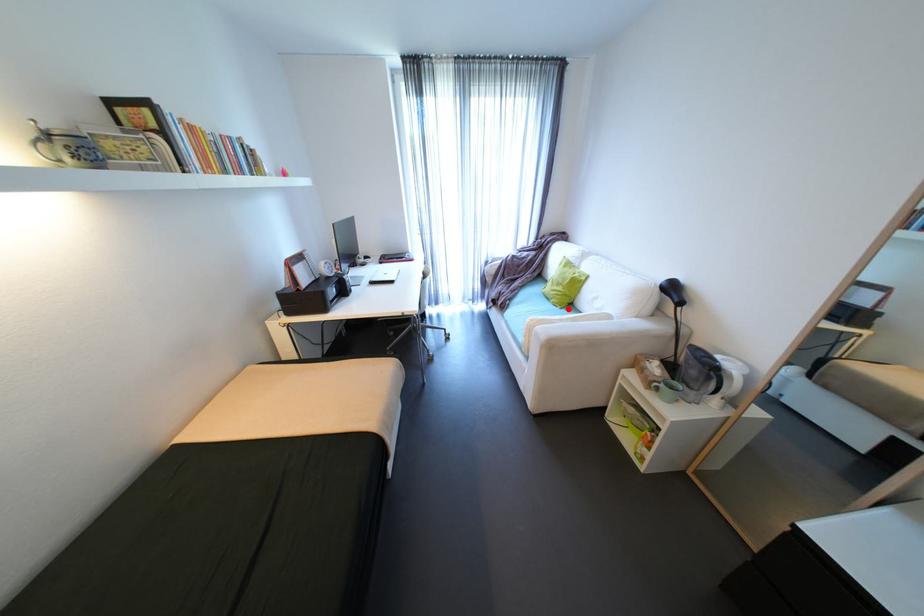
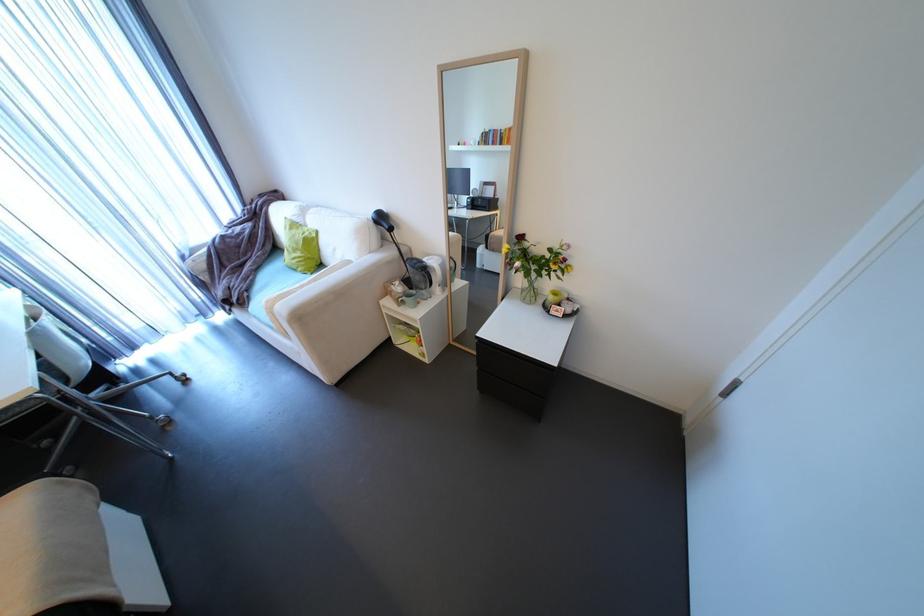
Question: I am providing you with two images of the same scene from different viewpoints. In image1, a red point is highlighted. Considering the same 3D point in image2, which of the following is correct?

Choices:
 (A) It is closer
 (B) It is farther

Answer: (B)